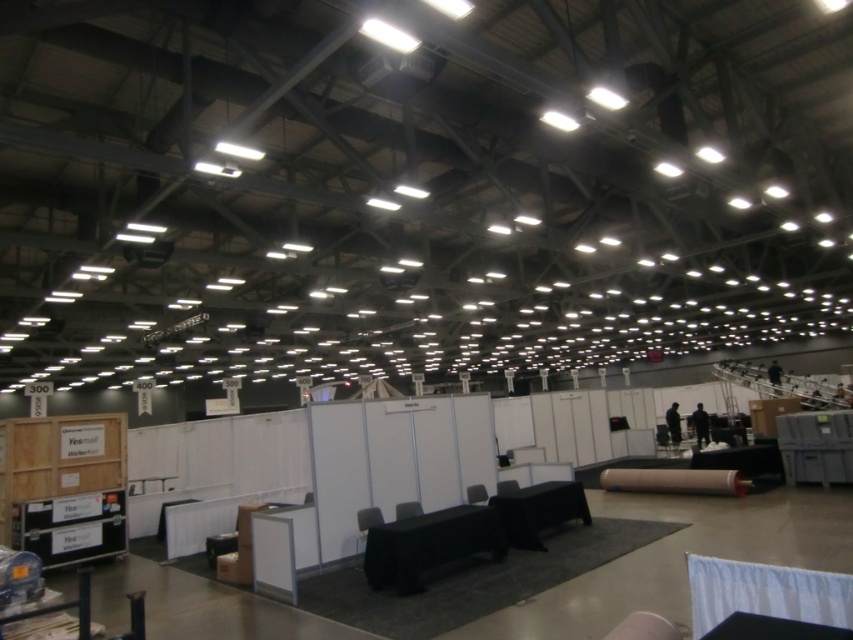
You are a convention attendee holding a map and standing at the entrance of the exhibition hall. You see the matte cardboard roll at center and the matte gray chair at center. Which object is closer to you?

The matte cardboard roll at center is closer to you because it is positioned further to the viewer than the matte gray chair at center.

Based on the photo, you are an event organizer setting up a booth in the convention center. You have a matte cardboard roll at center and a matte gray chair at center. Which object is taller?

The matte cardboard roll at center is much taller than the matte gray chair at center.